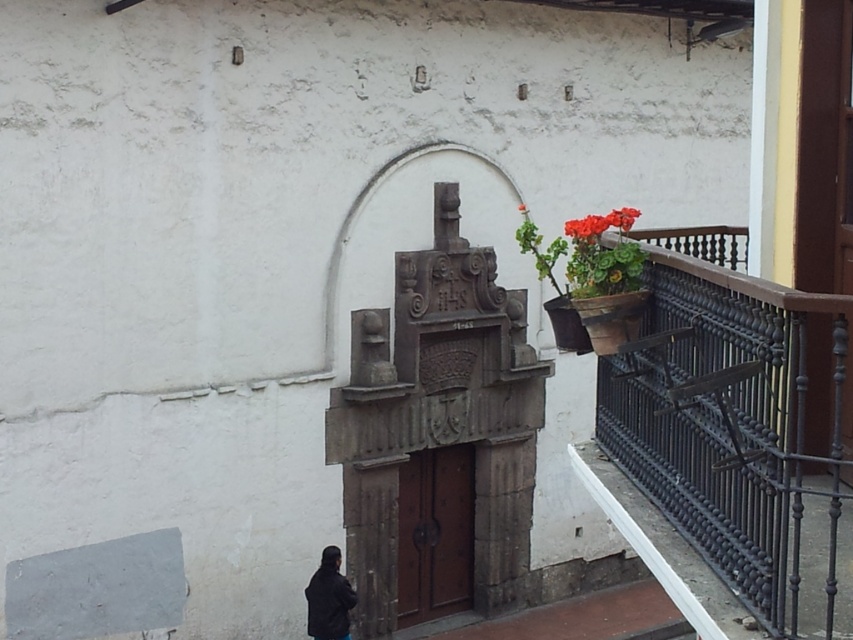
Is point (654, 289) less distant than point (524, 211)?

Yes, point (654, 289) is in front of point (524, 211).

Identify the location of black wrought iron railing at right. This screenshot has width=853, height=640. (740, 426).

Identify the location of black wrought iron railing at right. Image resolution: width=853 pixels, height=640 pixels. (740, 426).

Which is above, black wrought iron railing at right or stone archway at center?

stone archway at center is higher up.

Is point (801, 484) positioned in front of point (352, 228)?

That is True.

Locate an element on the screen. The height and width of the screenshot is (640, 853). black wrought iron railing at right is located at coordinates (740, 426).

Does black wrought iron railing at right appear on the right side of vivid red petals at upper right?

Correct, you'll find black wrought iron railing at right to the right of vivid red petals at upper right.

Can you confirm if black wrought iron railing at right is positioned above vivid red petals at upper right?

Actually, black wrought iron railing at right is below vivid red petals at upper right.

Between point (738, 588) and point (590, 228), which one is positioned behind?

The point (590, 228) is more distant.

At what (x,y) coordinates should I click in order to perform the action: click on black wrought iron railing at right. Please return your answer as a coordinate pair (x, y). The height and width of the screenshot is (640, 853). Looking at the image, I should click on (740, 426).